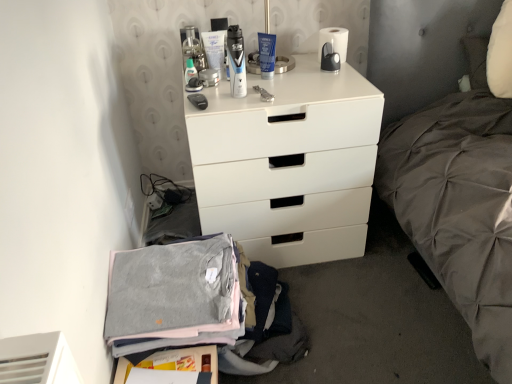
Question: Is translucent plastic bottle at upper center positioned before white matte chest of drawers at center?

Choices:
 (A) yes
 (B) no

Answer: (B)

Question: Is translucent plastic bottle at upper center facing away from white matte chest of drawers at center?

Choices:
 (A) no
 (B) yes

Answer: (A)

Question: Does translucent plastic bottle at upper center have a greater width compared to white matte chest of drawers at center?

Choices:
 (A) no
 (B) yes

Answer: (A)

Question: From a real-world perspective, is translucent plastic bottle at upper center on top of white matte chest of drawers at center?

Choices:
 (A) yes
 (B) no

Answer: (A)

Question: Are translucent plastic bottle at upper center and white matte chest of drawers at center far apart?

Choices:
 (A) yes
 (B) no

Answer: (B)

Question: From the image's perspective, is white matte chest of drawers at center located above or below white matte toilet paper at upper center?

Choices:
 (A) below
 (B) above

Answer: (A)

Question: Looking at the image, does white matte chest of drawers at center seem bigger or smaller compared to white matte toilet paper at upper center?

Choices:
 (A) small
 (B) big

Answer: (B)

Question: Is white matte chest of drawers at center taller or shorter than white matte toilet paper at upper center?

Choices:
 (A) tall
 (B) short

Answer: (A)

Question: Does point (238, 241) appear closer or farther from the camera than point (336, 34)?

Choices:
 (A) farther
 (B) closer

Answer: (B)

Question: Is translucent plastic bottle at upper center to the left or to the right of white matte chest of drawers at center in the image?

Choices:
 (A) right
 (B) left

Answer: (B)

Question: Is translucent plastic bottle at upper center taller or shorter than white matte chest of drawers at center?

Choices:
 (A) tall
 (B) short

Answer: (B)

Question: From the image's perspective, is translucent plastic bottle at upper center positioned above or below white matte chest of drawers at center?

Choices:
 (A) below
 (B) above

Answer: (B)

Question: Relative to white matte chest of drawers at center, is translucent plastic bottle at upper center in front or behind?

Choices:
 (A) behind
 (B) front

Answer: (A)

Question: Is white matte chest of drawers at center inside the boundaries of gray cotton sweater at lower left, or outside?

Choices:
 (A) inside
 (B) outside

Answer: (B)

Question: In terms of width, does white matte chest of drawers at center look wider or thinner when compared to gray cotton sweater at lower left?

Choices:
 (A) wide
 (B) thin

Answer: (A)